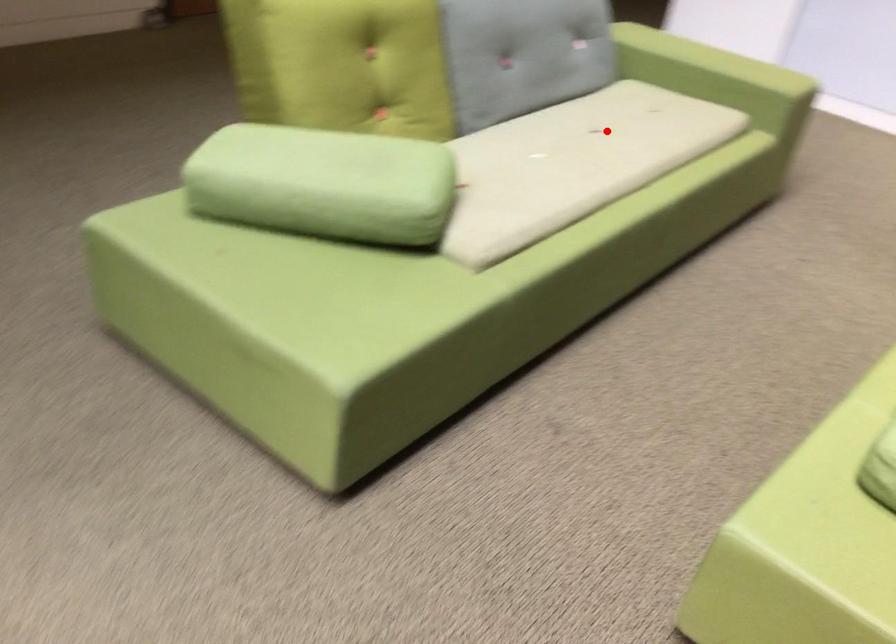
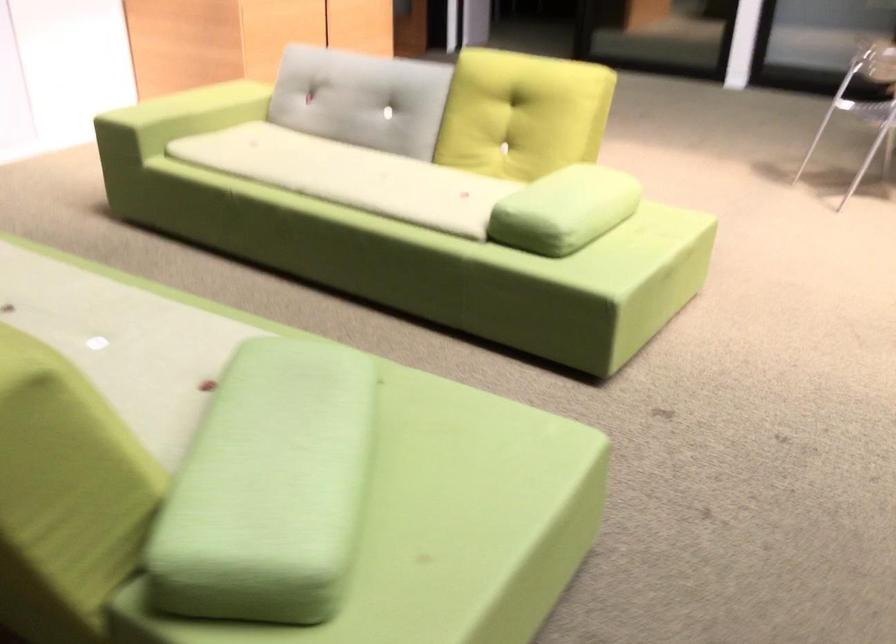
Question: I am providing you with two images of the same scene from different viewpoints. Given a red point in image1, look at the same physical point in image2. Is it:

Choices:
 (A) Closer to the viewpoint
 (B) Farther from the viewpoint

Answer: (A)